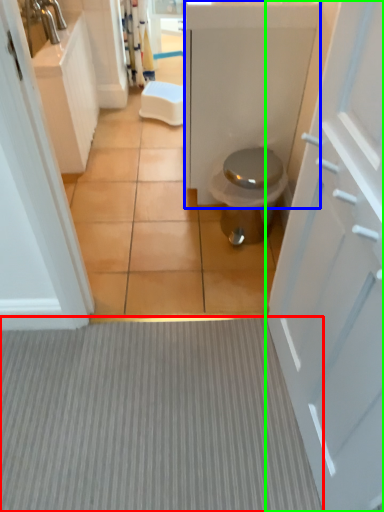
Question: Which object is the closest to the plain (highlighted by a red box)? Choose among these: bath (highlighted by a blue box) or door (highlighted by a green box).

Choices:
 (A) bath
 (B) door

Answer: (B)